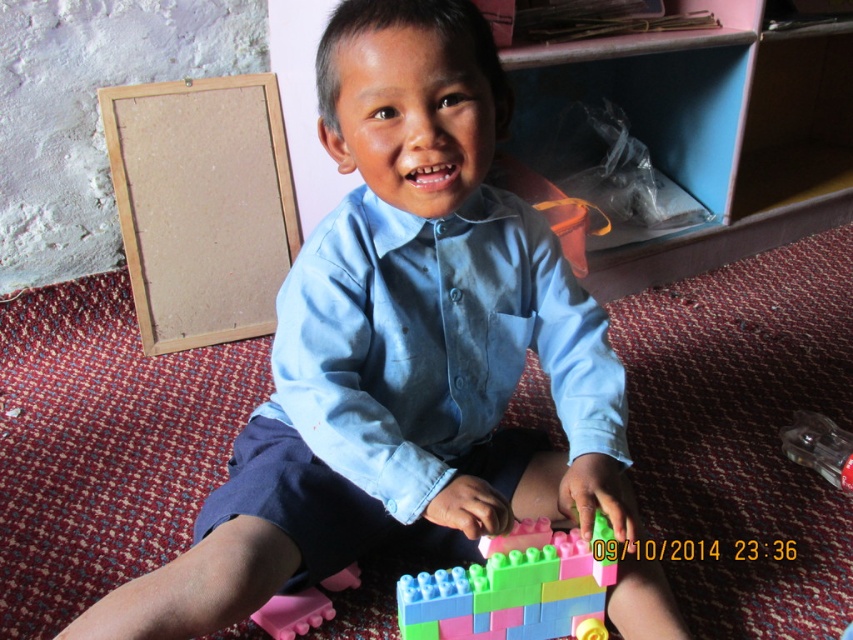
You are a parent who wants to place the pink rubber toy at lower left into a container that can fit it. The container is exactly the same width as the pastel plastic blocks at lower center. Will the container be wide enough?

The pastel plastic blocks at lower center might be wider than pink rubber toy at lower left, so the container with their width should be wide enough to fit the pink rubber toy at lower left.

You are a photographer standing in front of the scene. You want to take a photo focusing on the light blue cotton shirt at center without the bare wood frame at upper left appearing in the background. Is this possible based on their positions?

The light blue cotton shirt at center is closer to the viewer than the bare wood frame at upper left. By positioning the camera so that the shirt is in the foreground and the frame is out of the frame or blurred in the background, it is possible to take a photo focusing on the shirt without the frame appearing.

You are a parent trying to organize the play area. The child is currently playing with the pastel plastic blocks at lower center and the pink rubber toy at lower left. You want to place both items on a shelf that is 12 inches wide. Can both items fit side by side on the shelf without overlapping?

The pastel plastic blocks at lower center and pink rubber toy at lower left are 9.68 inches apart, so they can fit side by side on the 12 inch wide shelf since the total space they occupy is less than the shelf width.